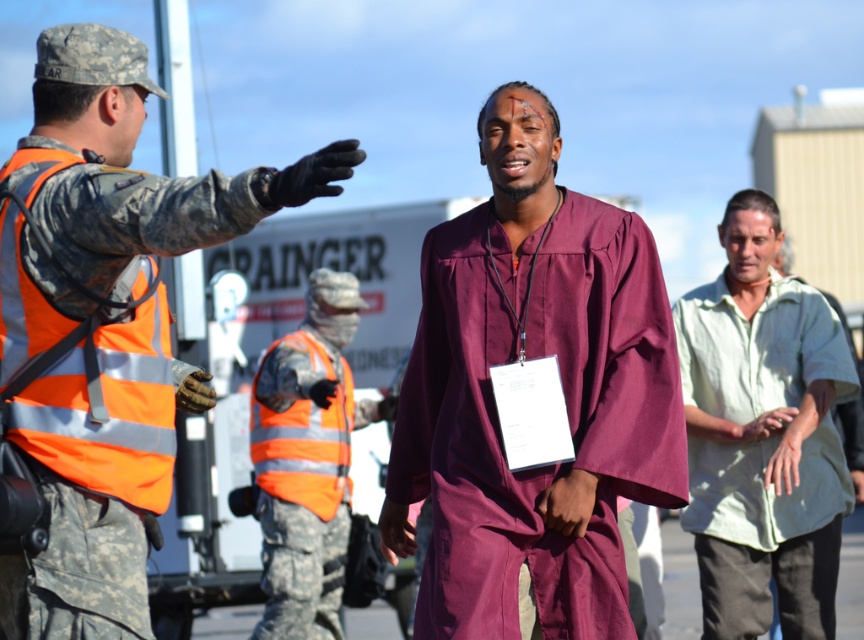
Is point (0, 388) positioned behind point (335, 413)?

That is False.

Who is lower down, orange reflective safety vest at left or reflective orange safety vest at center?

reflective orange safety vest at center is lower down.

Locate an element on the screen. The image size is (864, 640). orange reflective safety vest at left is located at coordinates (108, 404).

Between maroon fabric jumpsuit at center and camouflage fabric uniform at center, which one appears on the right side from the viewer's perspective?

From the viewer's perspective, maroon fabric jumpsuit at center appears more on the right side.

From the picture: Can you confirm if maroon fabric jumpsuit at center is bigger than camouflage fabric uniform at center?

No.

Between point (510, 189) and point (329, 573), which one is positioned behind?

The point (329, 573) is more distant.

What are the coordinates of `maroon fabric jumpsuit at center` in the screenshot? It's located at [x=561, y=387].

Is camouflage uniform at left further to camera compared to light green cotton shirt at right?

No, it is in front of light green cotton shirt at right.

Does camouflage uniform at left have a larger size compared to light green cotton shirt at right?

No.

Which is behind, point (75, 445) or point (780, 509)?

The point (780, 509) is behind.

Find the location of a particular element. The image size is (864, 640). camouflage uniform at left is located at coordinates (106, 323).